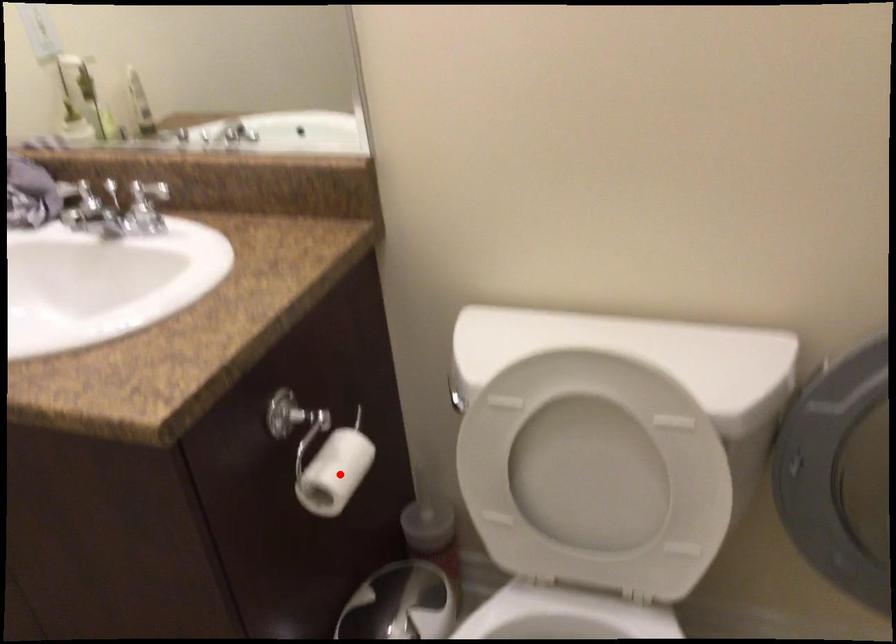
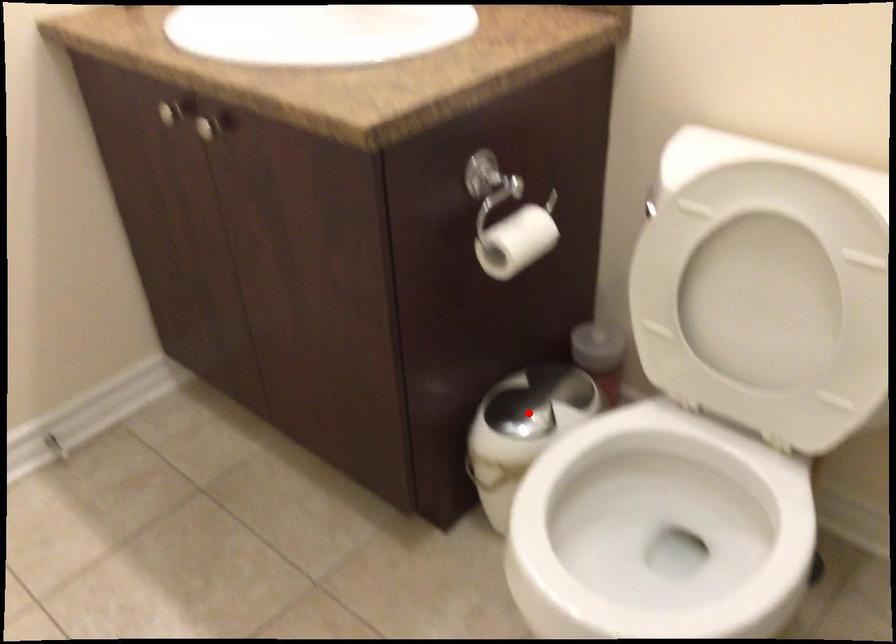
I am providing you with two images of the same scene from different viewpoints. A red point is marked on the first image and another point is marked on the second image. Is the marked point in image1 the same physical position as the marked point in image2?

No